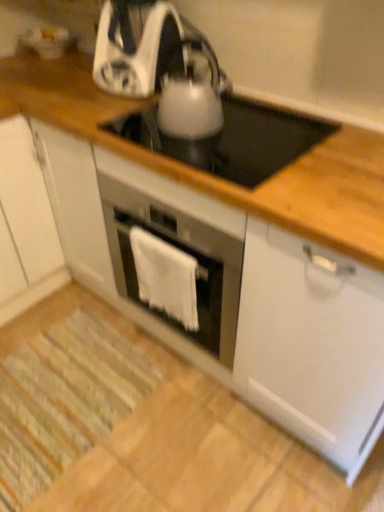
Question: Does white glossy electric kettle at center have a lesser height compared to white fabric towel at center?

Choices:
 (A) yes
 (B) no

Answer: (A)

Question: Is white glossy electric kettle at center turned away from white fabric towel at center?

Choices:
 (A) yes
 (B) no

Answer: (B)

Question: From the image's perspective, is white glossy electric kettle at center over white fabric towel at center?

Choices:
 (A) no
 (B) yes

Answer: (B)

Question: Can you confirm if white glossy electric kettle at center is bigger than white fabric towel at center?

Choices:
 (A) no
 (B) yes

Answer: (B)

Question: Is white glossy electric kettle at center wider than white fabric towel at center?

Choices:
 (A) no
 (B) yes

Answer: (B)

Question: Looking at the image, does white glossy electric kettle at center seem bigger or smaller compared to satin silver kettle at center, arranged as the 1th kitchen appliance when viewed from the front?

Choices:
 (A) small
 (B) big

Answer: (B)

Question: Is white glossy electric kettle at center wider or thinner than satin silver kettle at center, which appears as the 2th kitchen appliance when viewed from the back?

Choices:
 (A) wide
 (B) thin

Answer: (A)

Question: Is point (292, 130) closer or farther from the camera than point (185, 47)?

Choices:
 (A) farther
 (B) closer

Answer: (B)

Question: Is white glossy electric kettle at center in front of or behind satin silver kettle at center, arranged as the 1th kitchen appliance when viewed from the front, in the image?

Choices:
 (A) behind
 (B) front

Answer: (B)

Question: Choose the correct answer: Is white glossy kettle at upper center, acting as the first kitchen appliance starting from the back, inside satin silver kettle at center, which appears as the 2th kitchen appliance when viewed from the back, or outside it?

Choices:
 (A) outside
 (B) inside

Answer: (A)

Question: From the image's perspective, relative to satin silver kettle at center, which appears as the 2th kitchen appliance when viewed from the back, is white glossy kettle at upper center, arranged as the 2th kitchen appliance when viewed from the front, above or below?

Choices:
 (A) below
 (B) above

Answer: (B)

Question: Is white glossy kettle at upper center, arranged as the 2th kitchen appliance when viewed from the front, bigger or smaller than satin silver kettle at center, arranged as the 1th kitchen appliance when viewed from the front?

Choices:
 (A) big
 (B) small

Answer: (A)

Question: From a real-world perspective, is white glossy kettle at upper center, acting as the first kitchen appliance starting from the back, above or below satin silver kettle at center, which appears as the 2th kitchen appliance when viewed from the back?

Choices:
 (A) above
 (B) below

Answer: (A)

Question: In the image, is white fabric towel at center on the left side or the right side of satin silver kettle at center, arranged as the 1th kitchen appliance when viewed from the front?

Choices:
 (A) right
 (B) left

Answer: (B)

Question: In the image, is white fabric towel at center positioned in front of or behind satin silver kettle at center, which appears as the 2th kitchen appliance when viewed from the back?

Choices:
 (A) front
 (B) behind

Answer: (B)